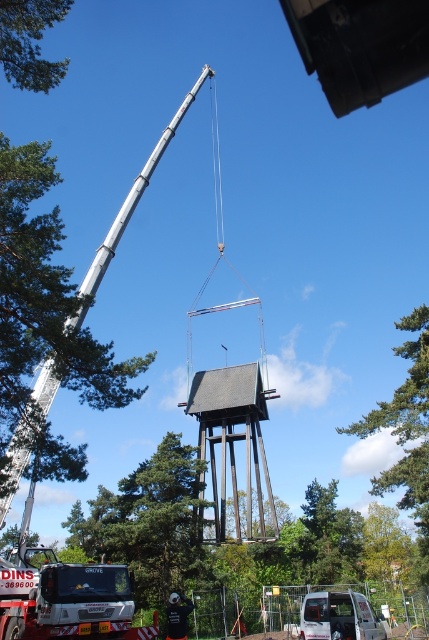
You are an engineer observing the crane and tree in the scene. Which object, the silver metallic crane at upper left or the green leafy tree at upper left, would cast a longer shadow at noon? Explain your reasoning based on their positions and the scene description.

The silver metallic crane at upper left would cast a longer shadow than the green leafy tree at upper left because it is much taller, as stated in the objects description. Since taller objects generally cast longer shadows when the sun is at the same angle, the crane being taller would result in a longer shadow.

You are a construction worker standing at the crane on the left side of the scene. You need to place a new flagpole exactly at the same position as the green leafy tree at center. What are the coordinates where you should place the flagpole?

The green leafy tree at center is located at point [148,524], so you should place the flagpole at those coordinates.

You are a construction worker observing the silver metallic crane at upper left and the green leafy tree at upper left. Which object is larger in size?

The silver metallic crane at upper left is bigger than the green leafy tree at upper left according to the description.